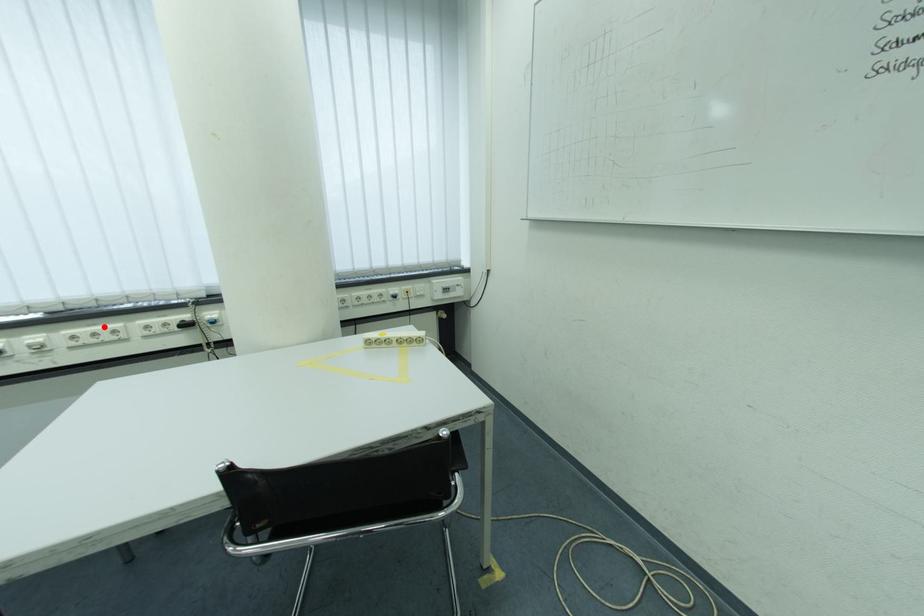
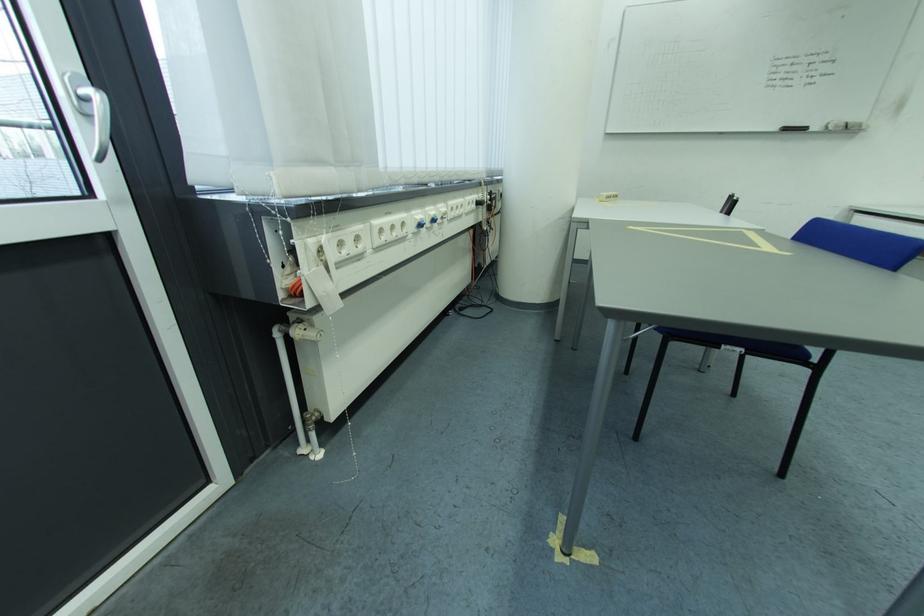
Find the pixel in the second image that matches the highlighted location in the first image.

(465, 200)